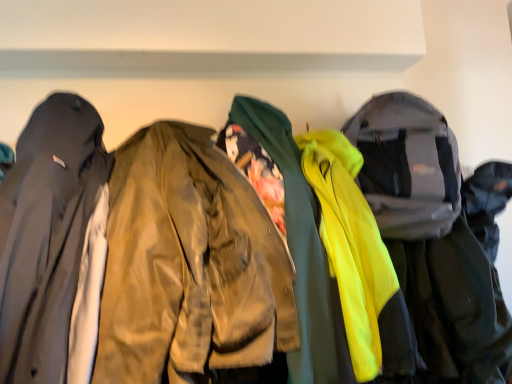
Question: Visually, is matte black jacket at left, the 1th jacket when ordered from left to right, positioned to the left or to the right of matte olive green jacket at center, placed as the 2th jacket when sorted from right to left?

Choices:
 (A) right
 (B) left

Answer: (B)

Question: From a real-world perspective, is matte black jacket at left, the 1th jacket when ordered from left to right, physically located above or below matte olive green jacket at center, placed as the 2th jacket when sorted from right to left?

Choices:
 (A) above
 (B) below

Answer: (A)

Question: Which of these objects is positioned farthest from the matte olive green jacket at center, the second jacket in the left-to-right sequence?

Choices:
 (A) matte black jacket at left, the 1th jacket when ordered from left to right
 (B) neon yellow fabric jacket at right, the third jacket viewed from the left

Answer: (B)

Question: Which object is the closest to the matte black jacket at left, which is counted as the 3th jacket, starting from the right?

Choices:
 (A) matte olive green jacket at center, placed as the 2th jacket when sorted from right to left
 (B) neon yellow fabric jacket at right, acting as the 1th jacket starting from the right

Answer: (A)